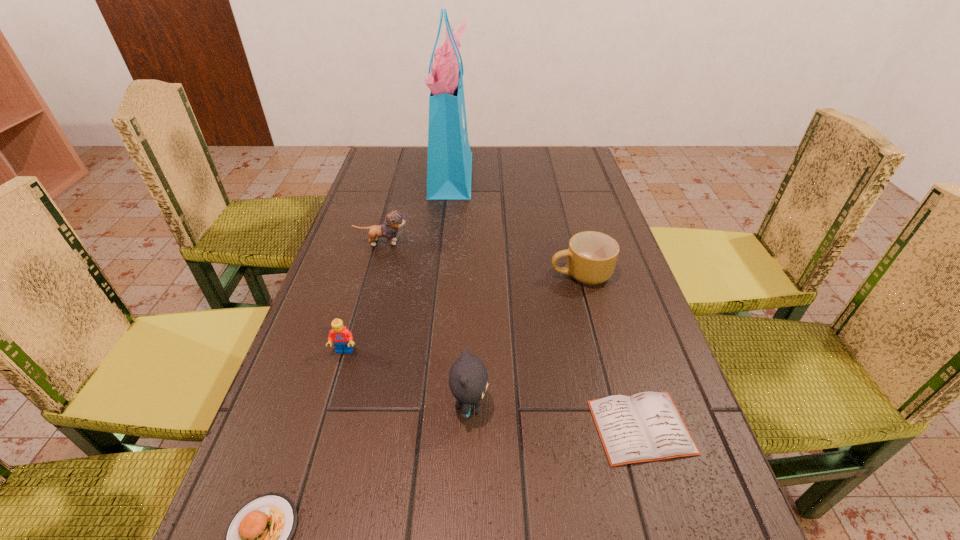
This screenshot has height=540, width=960. Identify the location of the farthest object. (449, 164).

At what (x,y) coordinates should I click in order to perform the action: click on shopping bag. Please return your answer as a coordinate pair (x, y). This screenshot has height=540, width=960. Looking at the image, I should click on (449, 164).

Image resolution: width=960 pixels, height=540 pixels. I want to click on the taller kitten, so click(x=468, y=377).

In order to click on the second tallest object in this screenshot , I will do `click(468, 377)`.

Find the location of a particular element. This screenshot has width=960, height=540. the shorter kitten is located at coordinates (x=394, y=219).

Find the location of `the second farthest object`. the second farthest object is located at coordinates (394, 219).

Find the location of `the fifth nearest object`. the fifth nearest object is located at coordinates (592, 256).

Where is `Lego`? The image size is (960, 540). Lego is located at coordinates (342, 338).

The width and height of the screenshot is (960, 540). In order to click on the shortest object in this screenshot , I will do `click(647, 426)`.

You are a GUI agent. You are given a task and a screenshot of the screen. Output one action in this format:
    pyautogui.click(x=<x>, y=<y>)
    Task: Click on the vacant position located 0.060m on the left of the shopping bag
    The height and width of the screenshot is (540, 960).
    Given the screenshot: What is the action you would take?
    pyautogui.click(x=413, y=173)